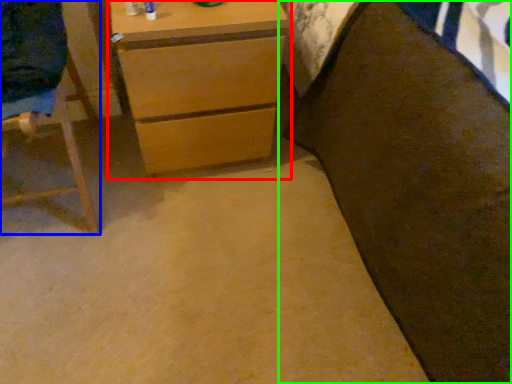
Question: Which object is the closest to the chest of drawers (highlighted by a red box)? Choose among these: furniture (highlighted by a blue box) or bed (highlighted by a green box).

Choices:
 (A) furniture
 (B) bed

Answer: (A)